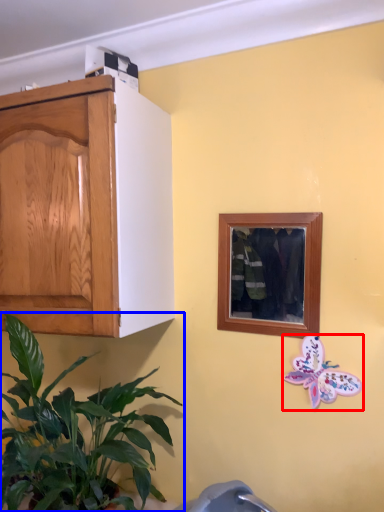
Question: Among these objects, which one is farthest to the camera, butterfly (highlighted by a red box) or houseplant (highlighted by a blue box)?

Choices:
 (A) butterfly
 (B) houseplant

Answer: (A)